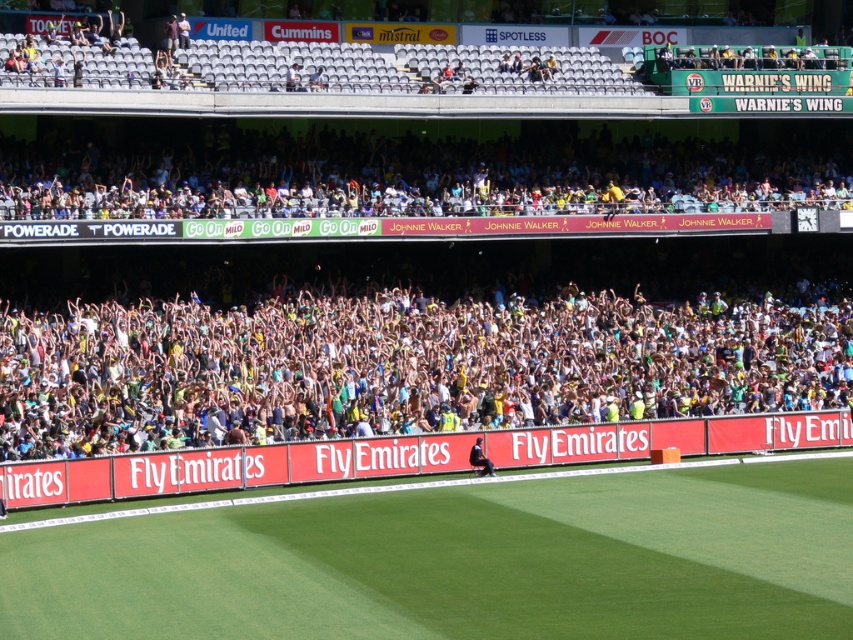
Measure the distance from yellow-green jersey crowd at center to dark blue uniform at center.

yellow-green jersey crowd at center is 26.23 feet from dark blue uniform at center.

Is point (436, 346) positioned in front of point (474, 456)?

No, it is behind (474, 456).

Find the location of a particular element. This screenshot has height=640, width=853. yellow-green jersey crowd at center is located at coordinates (398, 368).

Is point (729, 500) more distant than point (469, 310)?

That is False.

Who is positioned more to the right, green grass football field at center or yellow-green jersey crowd at center?

Positioned to the right is green grass football field at center.

Measure the distance between point (761, 554) and camera.

34.45 meters

Locate an element on the screen. green grass football field at center is located at coordinates (461, 563).

Which of these two, yellow-green jersey crowd at center or multicolored plastic crowd at upper center, stands taller?

multicolored plastic crowd at upper center is taller.

Identify the location of yellow-green jersey crowd at center. The width and height of the screenshot is (853, 640). (398, 368).

Image resolution: width=853 pixels, height=640 pixels. Identify the location of yellow-green jersey crowd at center. (398, 368).